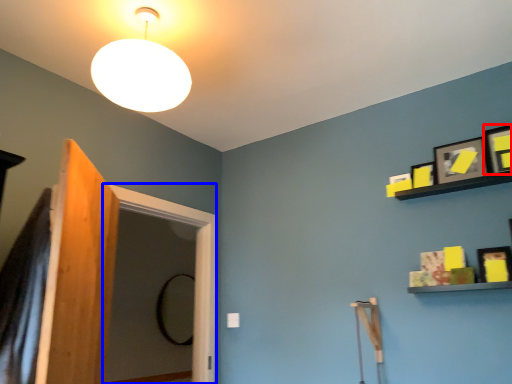
Question: Which of the following is the closest to the observer, picture frame (highlighted by a red box) or screen door (highlighted by a blue box)?

Choices:
 (A) picture frame
 (B) screen door

Answer: (A)